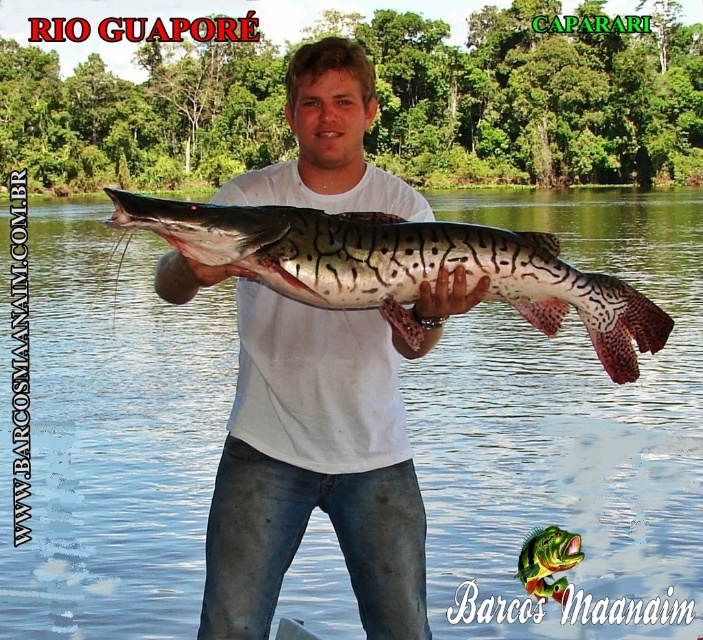
Question: Which of the following is the closest to the observer?

Choices:
 (A) clear water at center
 (B) white matte shirt at center
 (C) speckled skin catfish at center

Answer: (C)

Question: Is clear water at center bigger than speckled skin catfish at center?

Choices:
 (A) yes
 (B) no

Answer: (A)

Question: Is clear water at center wider than white matte shirt at center?

Choices:
 (A) no
 (B) yes

Answer: (B)

Question: Which point appears closest to the camera in this image?

Choices:
 (A) (245, 188)
 (B) (243, 236)
 (C) (483, 205)

Answer: (B)

Question: Which point is closer to the camera taking this photo?

Choices:
 (A) pos(509,513)
 (B) pos(352,273)

Answer: (B)

Question: Does clear water at center appear on the left side of white matte shirt at center?

Choices:
 (A) no
 (B) yes

Answer: (B)